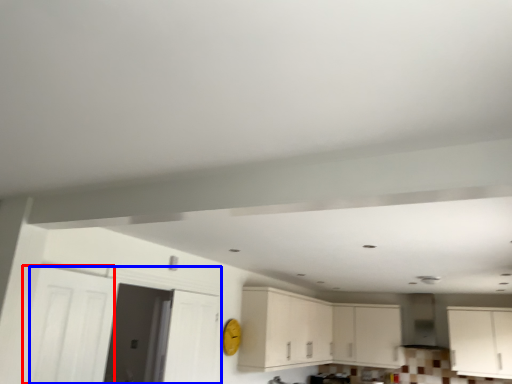
Question: Which point is closer to the camera, door (highlighted by a red box) or door (highlighted by a blue box)?

Choices:
 (A) door
 (B) door

Answer: (A)